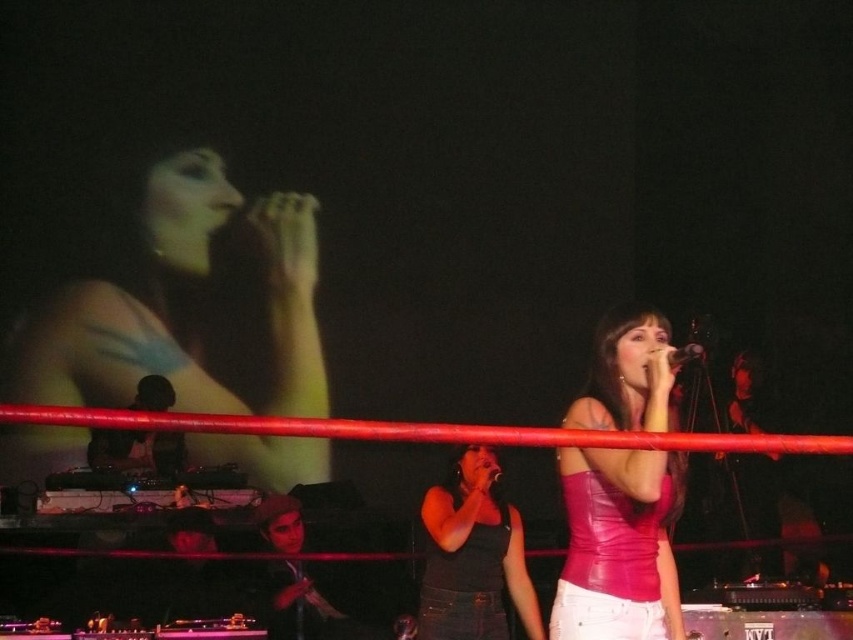
Is pink leather top at center below metallic silver microphone at upper center?

Yes, pink leather top at center is below metallic silver microphone at upper center.

Is pink leather top at center taller than metallic silver microphone at upper center?

Indeed, pink leather top at center has a greater height compared to metallic silver microphone at upper center.

Find the location of a particular element. pink leather top at center is located at coordinates (618, 545).

Who is positioned more to the right, pink leather top at center or matte black tank top at center?

From the viewer's perspective, pink leather top at center appears more on the right side.

Describe the element at coordinates (618, 545) in the screenshot. I see `pink leather top at center` at that location.

At what (x,y) coordinates should I click in order to perform the action: click on pink leather top at center. Please return your answer as a coordinate pair (x, y). Looking at the image, I should click on (618, 545).

Between matte black microphone at upper left and matte black tank top at center, which one appears on the right side from the viewer's perspective?

matte black tank top at center is more to the right.

Which is in front, point (103, 346) or point (534, 621)?

Point (534, 621) is more forward.

Which is in front, point (286, 317) or point (450, 541)?

Positioned in front is point (450, 541).

Locate an element on the screen. The width and height of the screenshot is (853, 640). matte black microphone at upper left is located at coordinates (189, 305).